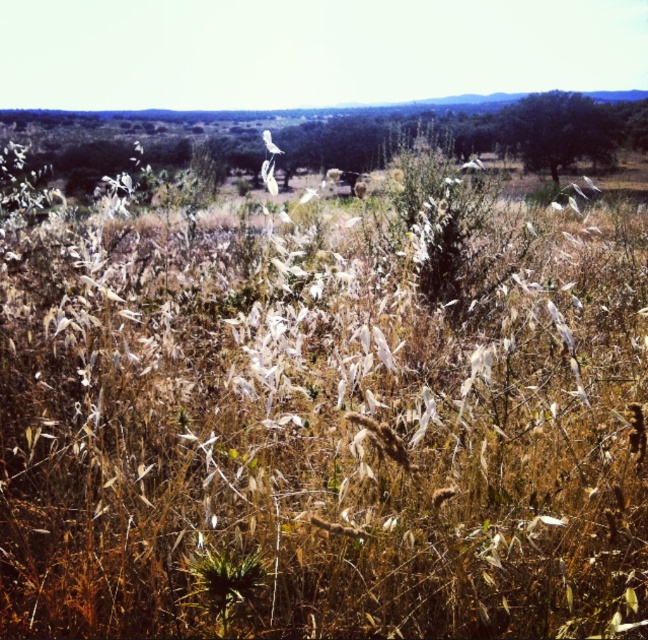
Is green leafy tree at upper right to the left of white matte bird at center from the viewer's perspective?

In fact, green leafy tree at upper right is to the right of white matte bird at center.

Who is more forward, [616,116] or [264,131]?

Point [264,131] is more forward.

Is point (561, 100) closer to viewer compared to point (270, 145)?

No, (561, 100) is behind (270, 145).

Where is `green leafy tree at upper right`? The height and width of the screenshot is (640, 648). green leafy tree at upper right is located at coordinates (559, 131).